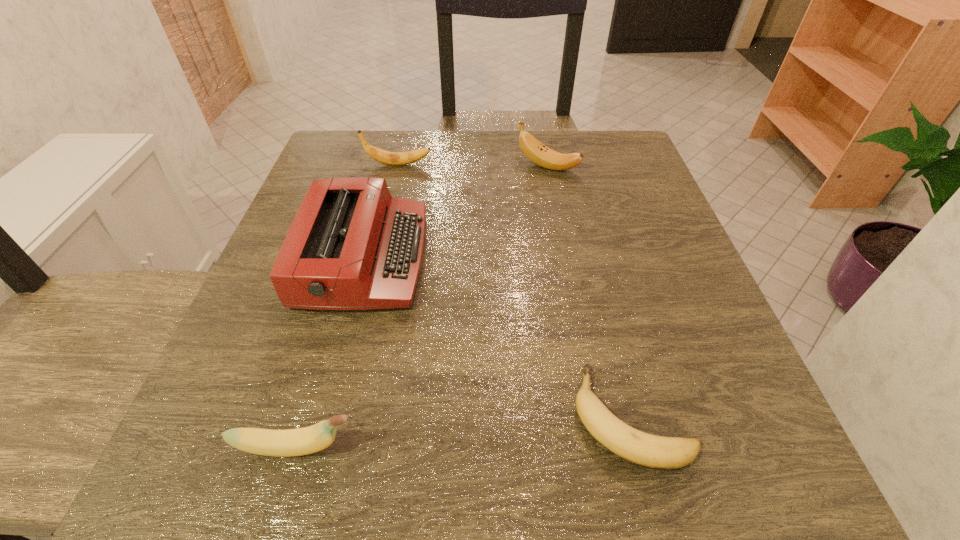
Where is `vacant area at the left edge of the desktop`? The image size is (960, 540). vacant area at the left edge of the desktop is located at coordinates (274, 293).

Locate an element on the screen. Image resolution: width=960 pixels, height=540 pixels. free space at the right edge of the desktop is located at coordinates (621, 327).

Find the location of a particular element. vacant space at the near left corner is located at coordinates (272, 493).

Locate an element on the screen. This screenshot has width=960, height=540. free space at the far right corner is located at coordinates (587, 167).

Identify the location of unoccupied area between the third nearest object and the shortest object. (497, 337).

Identify the location of blank region between the shortest banana and the typewriter. Image resolution: width=960 pixels, height=540 pixels. (497, 337).

This screenshot has height=540, width=960. I want to click on the closest object to the third farthest object, so click(389, 158).

Find the location of `object that is the second closest one to the third nearest object`. object that is the second closest one to the third nearest object is located at coordinates (302, 441).

Find the location of a particular element. The height and width of the screenshot is (540, 960). banana that can be found as the fourth closest to the third farthest object is located at coordinates (652, 451).

Locate an element on the screen. banana that is the closest to the shortest banana is located at coordinates (302, 441).